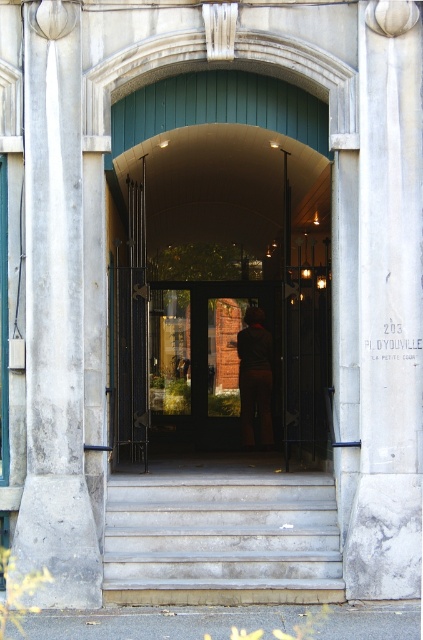
Who is positioned more to the left, white marble pillar at right or smooth concrete stairs at center?

smooth concrete stairs at center is more to the left.

Does white marble pillar at right appear on the left side of smooth concrete stairs at center?

Incorrect, white marble pillar at right is not on the left side of smooth concrete stairs at center.

Looking at this image, measure the distance between white marble pillar at right and camera.

white marble pillar at right and camera are 8.77 meters apart.

Where is `white marble pillar at right`? The height and width of the screenshot is (640, 423). white marble pillar at right is located at coordinates [389, 307].

Does white marble pillar at right appear over brown leather jacket at center?

Indeed, white marble pillar at right is positioned over brown leather jacket at center.

Is white marble pillar at right positioned in front of brown leather jacket at center?

Yes.

What do you see at coordinates (389, 307) in the screenshot? I see `white marble pillar at right` at bounding box center [389, 307].

Locate an element on the screen. The height and width of the screenshot is (640, 423). white marble pillar at right is located at coordinates (389, 307).

Is white marble pillar at right smaller than matte glass door at center?

No.

Can you confirm if white marble pillar at right is thinner than matte glass door at center?

Yes, white marble pillar at right is thinner than matte glass door at center.

Who is more forward, (386,419) or (235,413)?

Positioned in front is point (386,419).

Where is `white marble pillar at right`? This screenshot has width=423, height=640. white marble pillar at right is located at coordinates (389, 307).